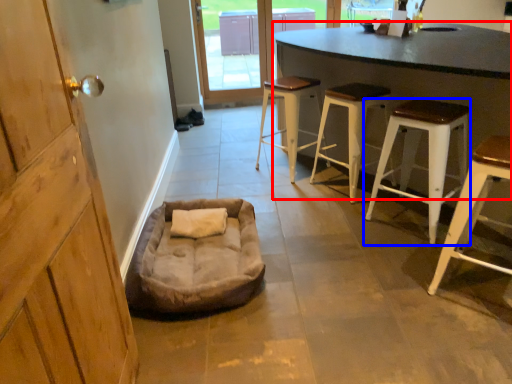
Question: Which of the following is the farthest to the observer, table (highlighted by a red box) or stool (highlighted by a blue box)?

Choices:
 (A) table
 (B) stool

Answer: (B)